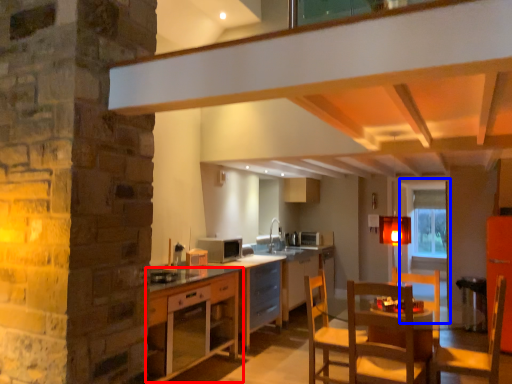
Question: Which object is further to the camera taking this photo, cabinetry (highlighted by a red box) or glass door (highlighted by a blue box)?

Choices:
 (A) cabinetry
 (B) glass door

Answer: (B)